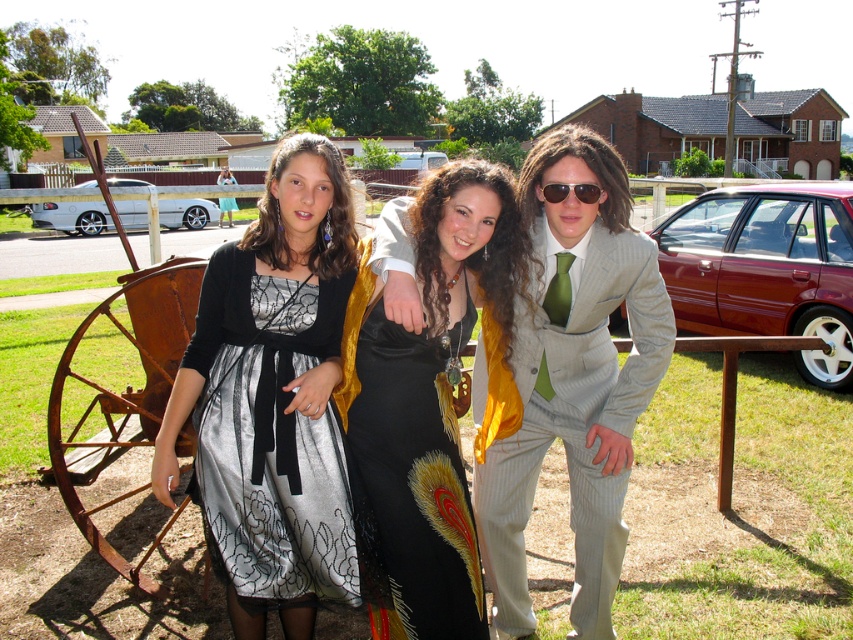
Question: Which is farther from the sunglasses at center?

Choices:
 (A) light gray pinstripe suit at center
 (B) black satin skirt at center
 (C) silver metallic sedan at left
 (D) maroon metallic sedan at right

Answer: (C)

Question: Can you confirm if light gray pinstripe suit at center is positioned above sunglasses at center?

Choices:
 (A) no
 (B) yes

Answer: (B)

Question: Is light gray pinstripe suit at center above maroon metallic sedan at right?

Choices:
 (A) yes
 (B) no

Answer: (B)

Question: Which point is closer to the camera?

Choices:
 (A) (178, 212)
 (B) (519, 177)
 (C) (434, 596)
 (D) (850, 374)

Answer: (C)

Question: Is silver metallic sedan at left below sunglasses at center?

Choices:
 (A) no
 (B) yes

Answer: (A)

Question: Among these objects, which one is nearest to the camera?

Choices:
 (A) light gray pinstripe suit at center
 (B) silver metallic sedan at left
 (C) maroon metallic sedan at right
 (D) silver satin dress at center

Answer: (A)